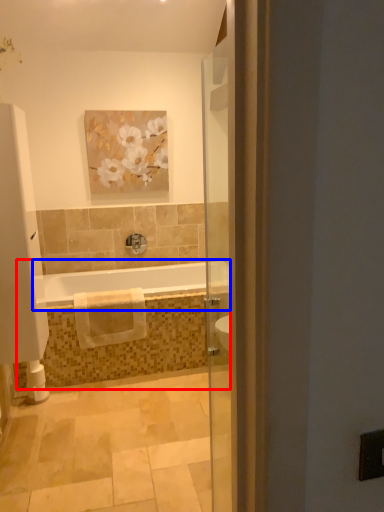
Question: Which object appears closest to the camera in this image, bath (highlighted by a red box) or bathtub (highlighted by a blue box)?

Choices:
 (A) bath
 (B) bathtub

Answer: (B)